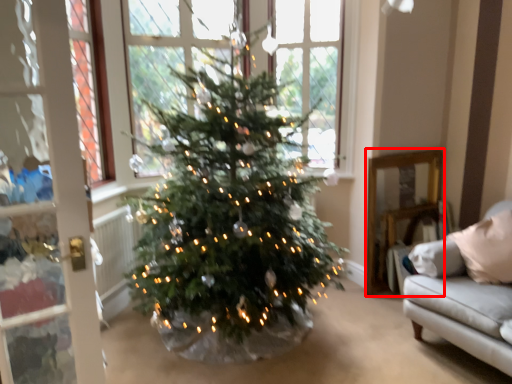
Question: From the image's perspective, what is the correct spatial relationship of furniture (annotated by the red box) in relation to window?

Choices:
 (A) above
 (B) below

Answer: (B)